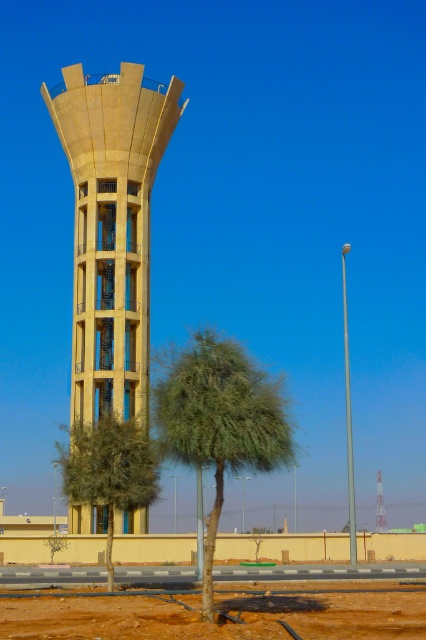
You are standing at the base of the beige concrete tower at center and want to plant a new tree between it and the green leafy tree at lower center. Is the space between them sufficient to accommodate a tree that requires 3 meters of clearance?

The beige concrete tower at center is located above the green leafy tree at lower center, which means they are vertically aligned rather than horizontally separated. Therefore, there is no horizontal space between them to plant a new tree requiring 3 meters of clearance.

You are an environmental scientist assessing the health of the trees in the area. Given that the green leafy tree at center and the green leafy tree at lower center are both present in the image, which tree would you prioritize for watering based on their size and the surrounding environment?

The green leafy tree at center is thinner than the green leafy tree at lower center, so the thinner tree may require more water to support its smaller size and the dry environment described in the scene.